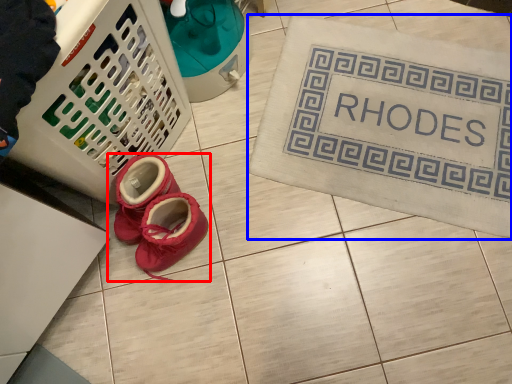
Question: Which point is further to the camera, footwear (highlighted by a red box) or bath mat (highlighted by a blue box)?

Choices:
 (A) footwear
 (B) bath mat

Answer: (B)